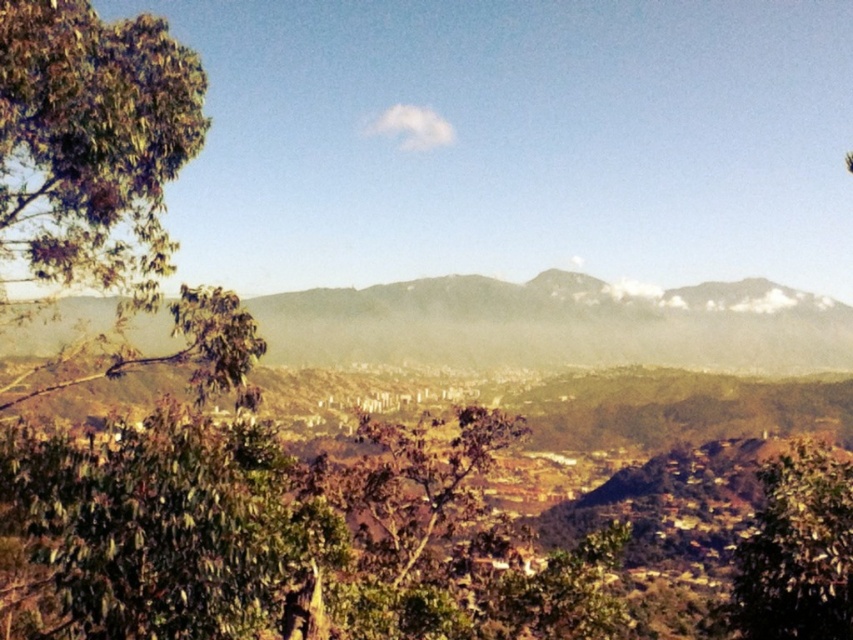
Question: Does green leafy tree at left appear under green textured mountain at center?

Choices:
 (A) no
 (B) yes

Answer: (A)

Question: Which object appears farthest from the camera in this image?

Choices:
 (A) green leafy tree at lower right
 (B) green textured mountain at center
 (C) green leafy tree at left

Answer: (B)

Question: Among these objects, which one is farthest from the camera?

Choices:
 (A) green leafy tree at lower right
 (B) green textured mountain at center
 (C) green leafy tree at left

Answer: (B)

Question: Observing the image, what is the correct spatial positioning of green leafy tree at left in reference to green leafy tree at lower right?

Choices:
 (A) right
 (B) left

Answer: (B)

Question: Which of the following is the farthest from the observer?

Choices:
 (A) (73, 328)
 (B) (114, 128)
 (C) (830, 563)

Answer: (A)

Question: Is green leafy tree at left further to the viewer compared to green leafy tree at lower right?

Choices:
 (A) no
 (B) yes

Answer: (A)